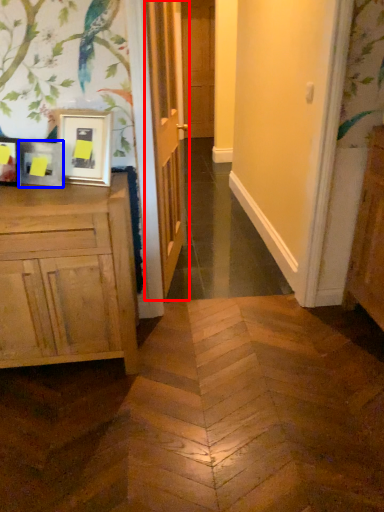
Question: Among these objects, which one is farthest to the camera, door (highlighted by a red box) or picture frame (highlighted by a blue box)?

Choices:
 (A) door
 (B) picture frame

Answer: (A)